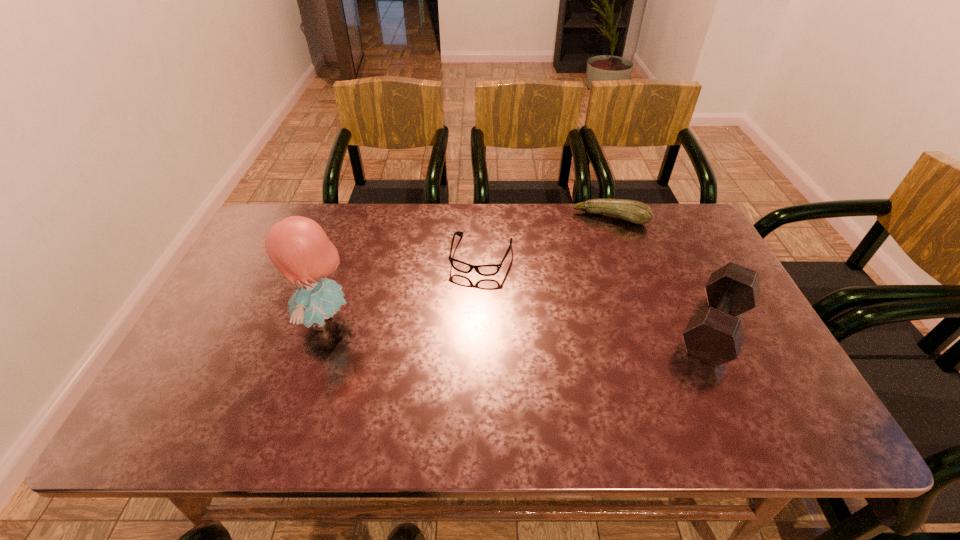
This screenshot has width=960, height=540. Identify the location of free space on the desktop that is between the leftmost object and the dumbbell and is positioned on the front-facing side of the third object from right to left. (461, 323).

The width and height of the screenshot is (960, 540). I want to click on vacant spot on the desktop that is between the leftmost object and the third shortest object and is positioned at the stem end of the third tallest object, so click(577, 325).